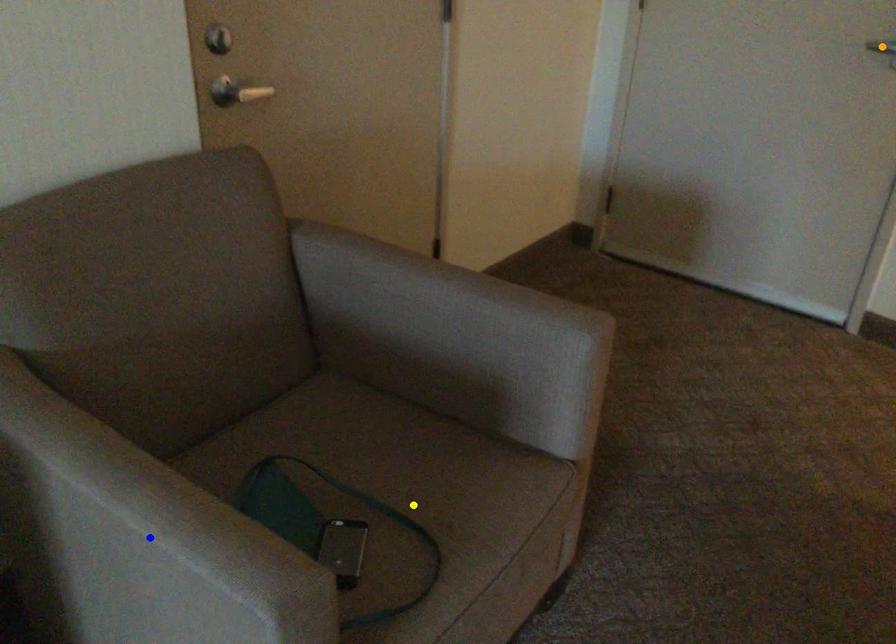
Looking at this image, order these from nearest to farthest:
orange point, blue point, yellow point

blue point → yellow point → orange point